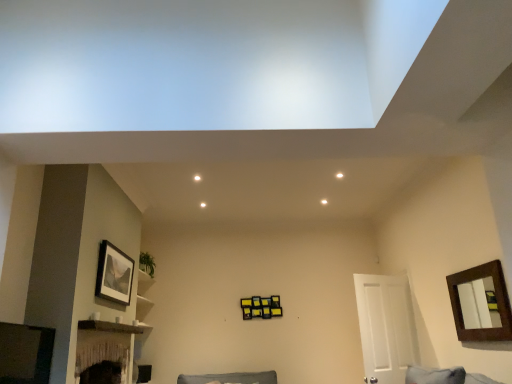
The image size is (512, 384). I want to click on brown wooden shelf at lower left, so click(109, 327).

At what (x,y) coordinates should I click in order to perform the action: click on white matte door at right. Please return your answer as a coordinate pair (x, y). Looking at the image, I should click on (385, 327).

The height and width of the screenshot is (384, 512). I want to click on brown wooden picture frame at upper right, the 2th picture frame from the left, so click(474, 293).

Who is taller, white matte door at right or matte black picture frame at upper left, the 1th picture frame positioned from the left?

white matte door at right.

Is white matte door at right wider than matte black picture frame at upper left, the 1th picture frame positioned from the left?

Indeed, white matte door at right has a greater width compared to matte black picture frame at upper left, the 1th picture frame positioned from the left.

Considering the positions of objects white matte door at right and matte black picture frame at upper left, the 2th picture frame when ordered from right to left, in the image provided, who is more to the left, white matte door at right or matte black picture frame at upper left, the 2th picture frame when ordered from right to left,?

Positioned to the left is matte black picture frame at upper left, the 2th picture frame when ordered from right to left.

Is white matte door at right positioned far away from matte black picture frame at upper left, the 1th picture frame positioned from the left?

Indeed, white matte door at right is not near matte black picture frame at upper left, the 1th picture frame positioned from the left.

Considering the sizes of brown wooden picture frame at upper right, the 2th picture frame from the left, and matte black picture frame at upper left, the 1th picture frame positioned from the left, in the image, is brown wooden picture frame at upper right, the 2th picture frame from the left, wider or thinner than matte black picture frame at upper left, the 1th picture frame positioned from the left,?

Considering their sizes, brown wooden picture frame at upper right, the 2th picture frame from the left, looks slimmer than matte black picture frame at upper left, the 1th picture frame positioned from the left.

Choose the correct answer: Is brown wooden picture frame at upper right, the 2th picture frame from the left, inside matte black picture frame at upper left, the 2th picture frame when ordered from right to left, or outside it?

brown wooden picture frame at upper right, the 2th picture frame from the left, is not inside matte black picture frame at upper left, the 2th picture frame when ordered from right to left, it's outside.

Based on the photo, does brown wooden picture frame at upper right, which is the first picture frame in right-to-left order, appear on the left side of matte black picture frame at upper left, the 2th picture frame when ordered from right to left?

Incorrect, brown wooden picture frame at upper right, which is the first picture frame in right-to-left order, is not on the left side of matte black picture frame at upper left, the 2th picture frame when ordered from right to left.

Is brown wooden picture frame at upper right, which is the first picture frame in right-to-left order, positioned with its back to matte black picture frame at upper left, the 2th picture frame when ordered from right to left?

No.

Is brown wooden picture frame at upper right, the 2th picture frame from the left, next to white matte door at right and touching it?

No, brown wooden picture frame at upper right, the 2th picture frame from the left, is not making contact with white matte door at right.

From a real-world perspective, which object rests below the other?

white matte door at right is physically lower.

Does brown wooden picture frame at upper right, the 2th picture frame from the left, have a smaller size compared to white matte door at right?

Indeed, brown wooden picture frame at upper right, the 2th picture frame from the left, has a smaller size compared to white matte door at right.

Locate an element on the screen. door behind the brown wooden picture frame at upper right, which is the first picture frame in right-to-left order is located at coordinates (385, 327).

Is white matte door at right oriented towards brown wooden shelf at lower left?

No, white matte door at right is not facing towards brown wooden shelf at lower left.

The image size is (512, 384). I want to click on door below the brown wooden shelf at lower left (from the image's perspective), so pyautogui.click(x=385, y=327).

Which is correct: white matte door at right is inside brown wooden shelf at lower left, or outside of it?

white matte door at right cannot be found inside brown wooden shelf at lower left.

From the image's perspective, is white matte door at right above brown wooden shelf at lower left?

No, from the image's perspective, white matte door at right is not on top of brown wooden shelf at lower left.

Can you tell me how much brown wooden shelf at lower left and matte black picture frame at upper left, the 2th picture frame when ordered from right to left, differ in facing direction?

The facing directions of brown wooden shelf at lower left and matte black picture frame at upper left, the 2th picture frame when ordered from right to left, are 0.394 degrees apart.

In terms of height, does brown wooden shelf at lower left look taller or shorter compared to matte black picture frame at upper left, the 1th picture frame positioned from the left?

Clearly, brown wooden shelf at lower left is shorter compared to matte black picture frame at upper left, the 1th picture frame positioned from the left.

Would you say brown wooden shelf at lower left contains matte black picture frame at upper left, the 2th picture frame when ordered from right to left?

That's incorrect, matte black picture frame at upper left, the 2th picture frame when ordered from right to left, is not inside brown wooden shelf at lower left.

Find the location of a particular element. The image size is (512, 384). shelf located in front of the matte black picture frame at upper left, the 2th picture frame when ordered from right to left is located at coordinates (109, 327).

Which of these two, brown wooden shelf at lower left or brown wooden picture frame at upper right, the 2th picture frame from the left, stands shorter?

With less height is brown wooden shelf at lower left.

From the image's perspective, is brown wooden shelf at lower left located above brown wooden picture frame at upper right, the 2th picture frame from the left?

No.

Is brown wooden shelf at lower left facing towards brown wooden picture frame at upper right, which is the first picture frame in right-to-left order?

Yes, brown wooden shelf at lower left is oriented towards brown wooden picture frame at upper right, which is the first picture frame in right-to-left order.

Does white matte door at right have a larger size compared to brown wooden picture frame at upper right, the 2th picture frame from the left?

Yes.

Where is `door below the brown wooden picture frame at upper right, which is the first picture frame in right-to-left order (from the image's perspective)`? door below the brown wooden picture frame at upper right, which is the first picture frame in right-to-left order (from the image's perspective) is located at coordinates (385, 327).

Is white matte door at right oriented away from brown wooden picture frame at upper right, the 2th picture frame from the left?

Yes, white matte door at right is facing away from brown wooden picture frame at upper right, the 2th picture frame from the left.

Is white matte door at right wider than brown wooden picture frame at upper right, which is the first picture frame in right-to-left order?

Correct, the width of white matte door at right exceeds that of brown wooden picture frame at upper right, which is the first picture frame in right-to-left order.

From the image's perspective, count 2nd picture frames upward from the white matte door at right and point to it. Please provide its 2D coordinates.

[(114, 274)]

Locate an element on the screen. picture frame behind the brown wooden picture frame at upper right, which is the first picture frame in right-to-left order is located at coordinates (114, 274).

Consider the image. From the image, which object appears to be farther from matte black picture frame at upper left, the 1th picture frame positioned from the left, white matte door at right or brown wooden shelf at lower left?

Based on the image, white matte door at right appears to be further to matte black picture frame at upper left, the 1th picture frame positioned from the left.

From the image, which object appears to be farther from brown wooden picture frame at upper right, which is the first picture frame in right-to-left order, brown wooden shelf at lower left or matte black picture frame at upper left, the 2th picture frame when ordered from right to left?

Among the two, matte black picture frame at upper left, the 2th picture frame when ordered from right to left, is located further to brown wooden picture frame at upper right, which is the first picture frame in right-to-left order.

When comparing their distances from matte black picture frame at upper left, the 2th picture frame when ordered from right to left, does brown wooden shelf at lower left or brown wooden picture frame at upper right, the 2th picture frame from the left, seem further?

brown wooden picture frame at upper right, the 2th picture frame from the left, is positioned further to the anchor matte black picture frame at upper left, the 2th picture frame when ordered from right to left.

Which object lies further to the anchor point white matte door at right, matte black picture frame at upper left, the 2th picture frame when ordered from right to left, or brown wooden shelf at lower left?

Among the two, matte black picture frame at upper left, the 2th picture frame when ordered from right to left, is located further to white matte door at right.

Which object lies further to the anchor point matte black picture frame at upper left, the 1th picture frame positioned from the left, brown wooden shelf at lower left or white matte door at right?

white matte door at right is positioned further to the anchor matte black picture frame at upper left, the 1th picture frame positioned from the left.

Based on their spatial positions, is brown wooden picture frame at upper right, the 2th picture frame from the left, or white matte door at right further from matte black picture frame at upper left, the 2th picture frame when ordered from right to left?

brown wooden picture frame at upper right, the 2th picture frame from the left, is further to matte black picture frame at upper left, the 2th picture frame when ordered from right to left.

Looking at the image, which one is located further to white matte door at right, brown wooden picture frame at upper right, which is the first picture frame in right-to-left order, or matte black picture frame at upper left, the 1th picture frame positioned from the left?

matte black picture frame at upper left, the 1th picture frame positioned from the left.

From the picture: Looking at the image, which one is located closer to brown wooden shelf at lower left, brown wooden picture frame at upper right, the 2th picture frame from the left, or white matte door at right?

white matte door at right.

Image resolution: width=512 pixels, height=384 pixels. I want to click on door between matte black picture frame at upper left, the 2th picture frame when ordered from right to left, and brown wooden picture frame at upper right, which is the first picture frame in right-to-left order, in the horizontal direction, so click(385, 327).

Locate an element on the screen. shelf situated between matte black picture frame at upper left, the 1th picture frame positioned from the left, and brown wooden picture frame at upper right, which is the first picture frame in right-to-left order, from left to right is located at coordinates (109, 327).

This screenshot has height=384, width=512. I want to click on shelf located between matte black picture frame at upper left, the 2th picture frame when ordered from right to left, and white matte door at right in the left-right direction, so click(109, 327).

Where is `door between brown wooden shelf at lower left and brown wooden picture frame at upper right, which is the first picture frame in right-to-left order, in the horizontal direction`? door between brown wooden shelf at lower left and brown wooden picture frame at upper right, which is the first picture frame in right-to-left order, in the horizontal direction is located at coordinates (385, 327).